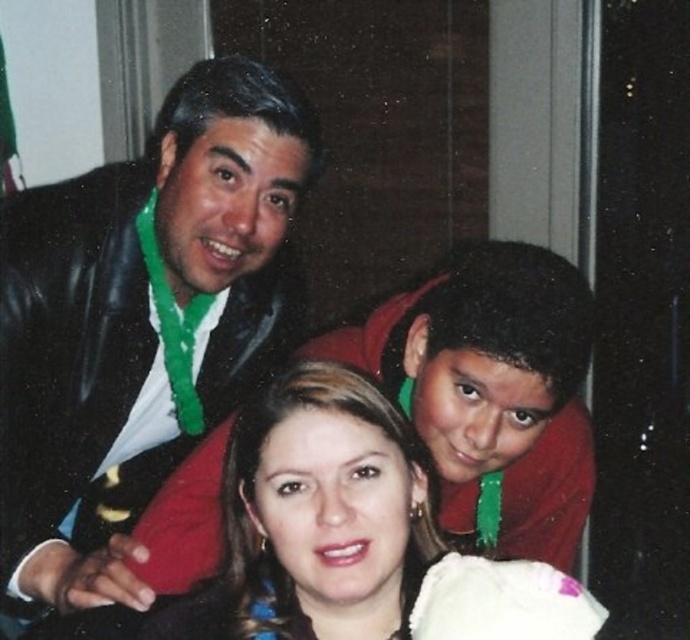
Question: Does matte black jacket at upper left have a lesser width compared to smooth skin face at center?

Choices:
 (A) yes
 (B) no

Answer: (B)

Question: Is matte black jacket at upper left to the right of smooth skin face at center from the viewer's perspective?

Choices:
 (A) yes
 (B) no

Answer: (B)

Question: Among these points, which one is farthest from the camera?

Choices:
 (A) (384, 460)
 (B) (108, 170)

Answer: (B)

Question: Considering the relative positions of matte black jacket at upper left and smooth skin face at center in the image provided, where is matte black jacket at upper left located with respect to smooth skin face at center?

Choices:
 (A) above
 (B) below

Answer: (A)